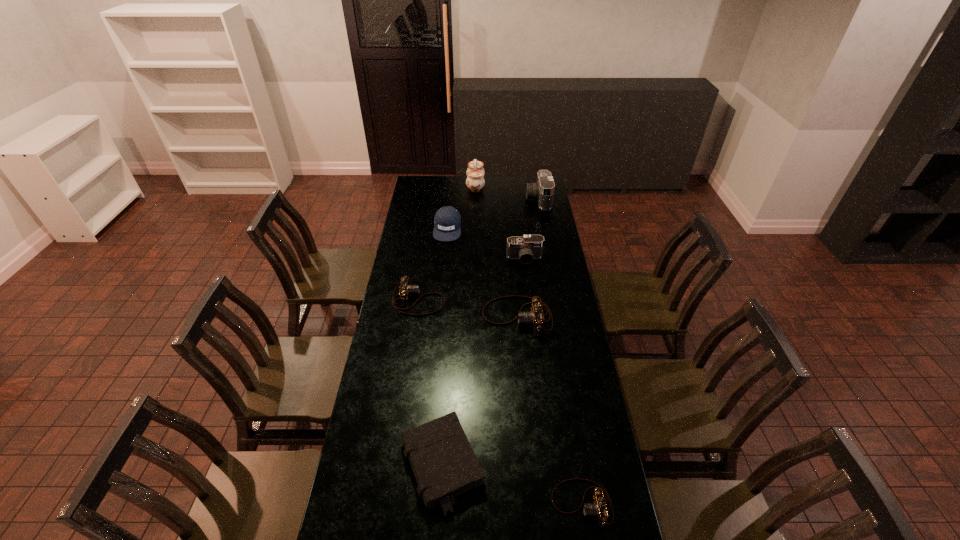
I want to click on white chinaware, so click(x=475, y=173).

Identify the location of the tallest object. (475, 173).

The image size is (960, 540). I want to click on the farther black camera, so click(x=543, y=190).

Find the location of a particular element. The height and width of the screenshot is (540, 960). the bigger black camera is located at coordinates (543, 190).

The image size is (960, 540). What are the coordinates of `the smaller black camera` in the screenshot? It's located at (529, 247).

The image size is (960, 540). What are the coordinates of `the fourth farthest object` in the screenshot? It's located at (529, 247).

Identify the location of baseball cap. (447, 219).

You are a GUI agent. You are given a task and a screenshot of the screen. Output one action in this format:
    pyautogui.click(x=<x>, y=<y>)
    Task: Click on the blue baseball cap
    The height and width of the screenshot is (540, 960).
    Given the screenshot: What is the action you would take?
    pyautogui.click(x=447, y=219)

This screenshot has height=540, width=960. Identify the location of the third tallest camera. (535, 318).

Locate an element on the screen. This screenshot has width=960, height=540. the second smallest brown camera is located at coordinates (405, 289).